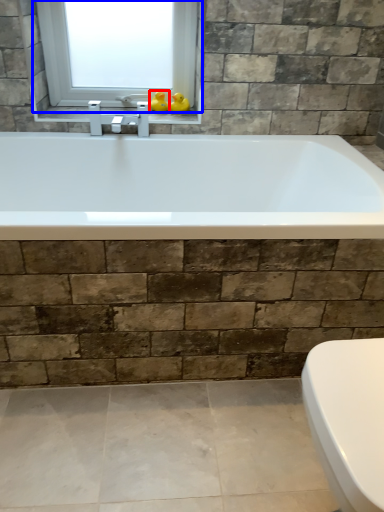
Question: Which point is closer to the camera, duck (highlighted by a red box) or window (highlighted by a blue box)?

Choices:
 (A) duck
 (B) window

Answer: (B)